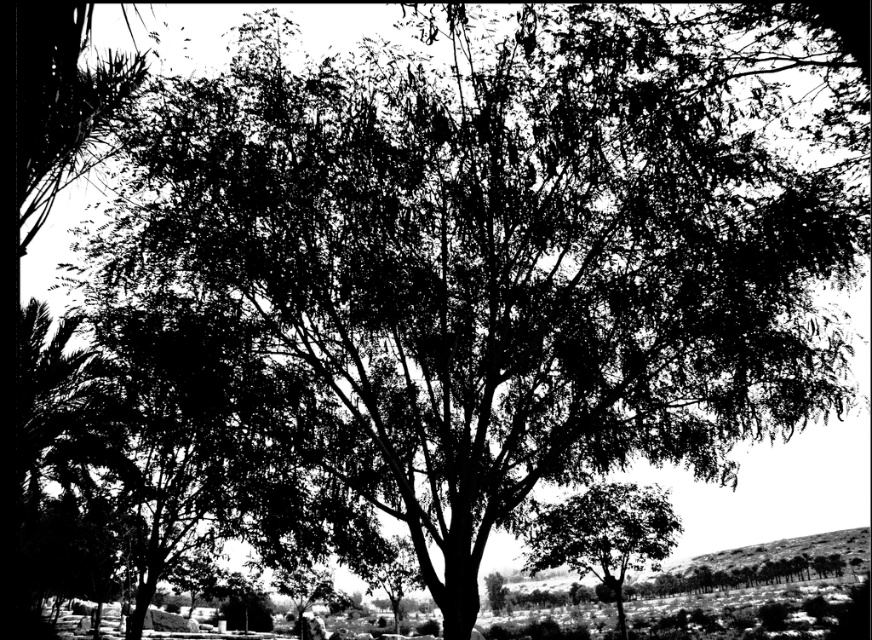
You are standing in the scene and want to place a small garden statue exactly at the lowest point between the smooth green tree at lower right and the smooth dirt hillside at lower right. Where should you place it?

The smooth green tree at lower right is above the smooth dirt hillside at lower right, so the lowest point between them would be at the base of the smooth dirt hillside at lower right.